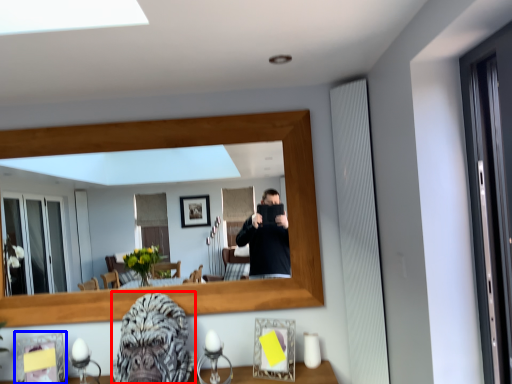
Question: Which object appears closest to the camera in this image, gorilla (highlighted by a red box) or picture frame (highlighted by a blue box)?

Choices:
 (A) gorilla
 (B) picture frame

Answer: (A)